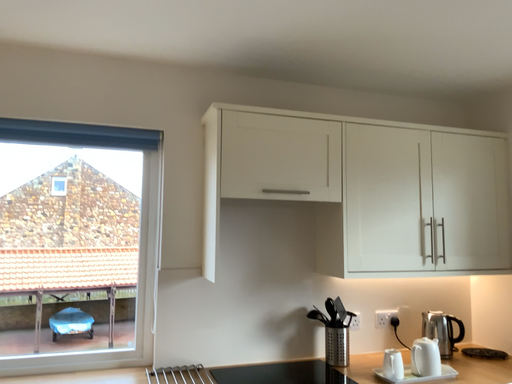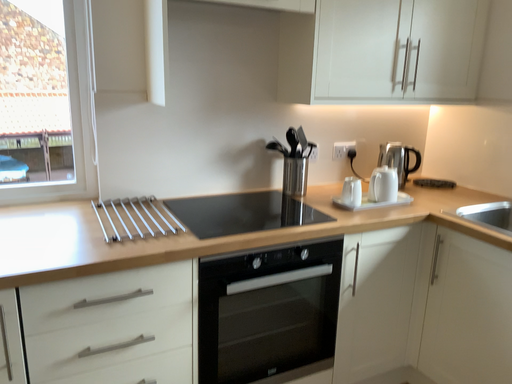
Question: Which way did the camera rotate in the video?

Choices:
 (A) rotated right
 (B) rotated left

Answer: (A)